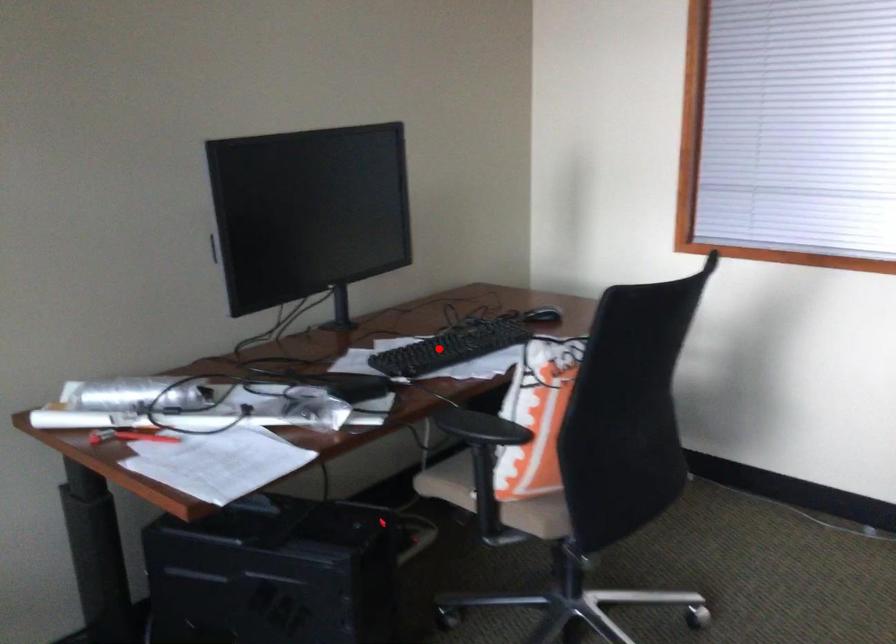
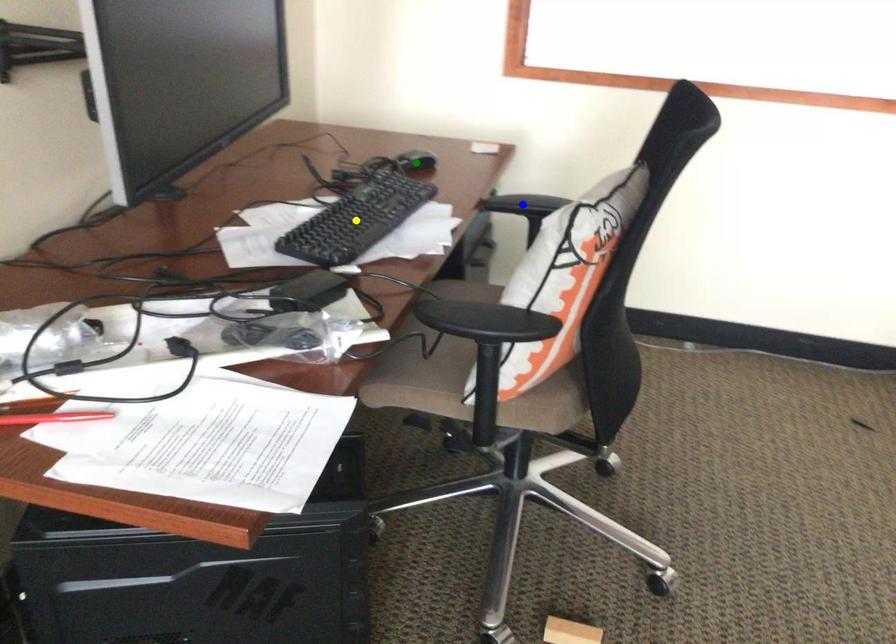
Question: I am providing you with two images of the same scene from different viewpoints. A red point is marked on the first image. You are given multiple points on the second image. Which point in image 2 represents the same 3d spot as the red point in image 1?

Choices:
 (A) yellow point
 (B) green point
 (C) blue point

Answer: (A)